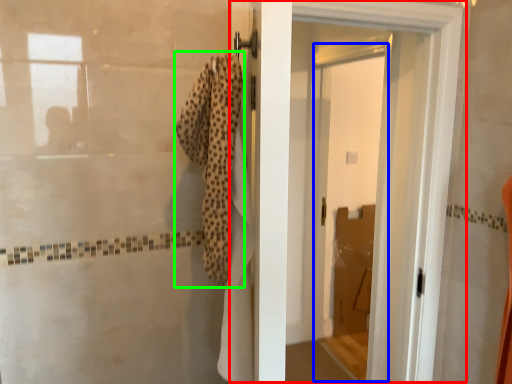
Question: Based on their relative distances, which object is farther from door (highlighted by a red box)? Choose from screen door (highlighted by a blue box) and bath towel (highlighted by a green box).

Choices:
 (A) screen door
 (B) bath towel

Answer: (A)